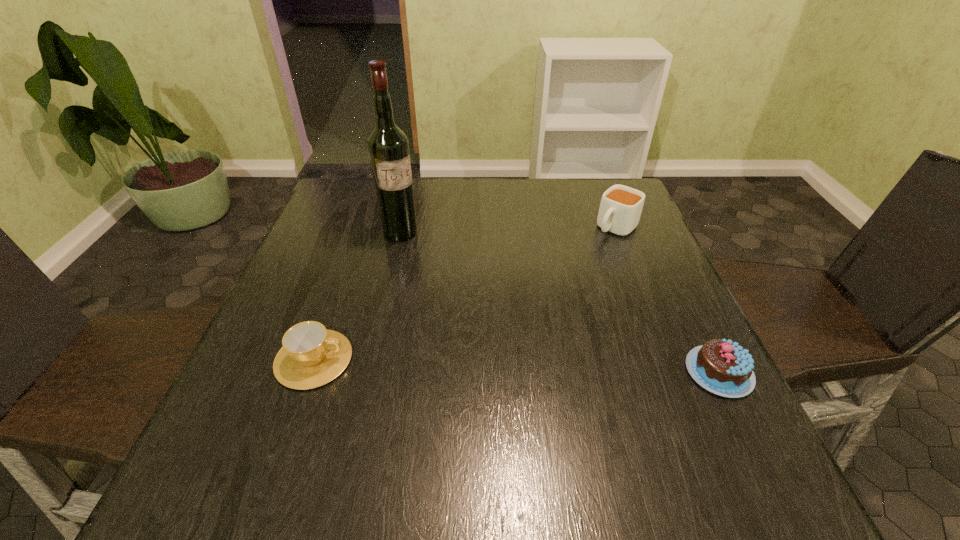
Identify the location of the left cup. (311, 356).

This screenshot has width=960, height=540. Find the location of `the shorter cup`. the shorter cup is located at coordinates (311, 356).

At what (x,y) coordinates should I click in order to perform the action: click on chocolate cake. Please return your answer as a coordinate pair (x, y). Looking at the image, I should click on (721, 366).

In order to click on wine bottle in this screenshot , I will do (x=388, y=146).

Where is `the third shortest object`? the third shortest object is located at coordinates (620, 209).

The height and width of the screenshot is (540, 960). I want to click on the taller cup, so click(x=620, y=209).

You are a GUI agent. You are given a task and a screenshot of the screen. Output one action in this format:
    pyautogui.click(x=<x>, y=<y>)
    Task: Click on the free space located 0.130m with the handle on the side of the left cup
    
    Given the screenshot: What is the action you would take?
    pyautogui.click(x=420, y=359)

Locate an element on the screen. The image size is (960, 540). vacant point located 0.080m on the back of the chocolate cake is located at coordinates (692, 318).

Image resolution: width=960 pixels, height=540 pixels. In order to click on vacant space located 0.090m on the front and back of the wine bottle in this screenshot , I will do `click(423, 260)`.

Identify the location of free space located 0.370m on the front and back of the wine bottle. (486, 333).